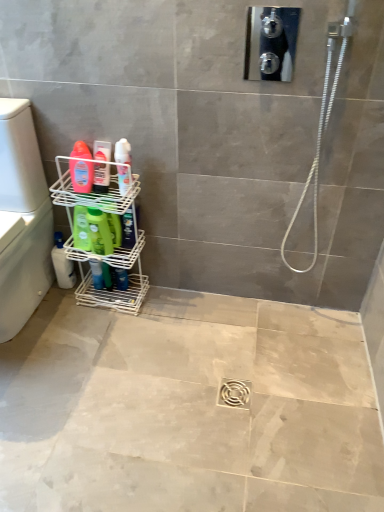
Question: Considering the positions of translucent plastic bottle at left, arranged as the second toiletry when viewed from the right, and green matte bottle at lower left, arranged as the second cleaning product when viewed from the front, in the image, is translucent plastic bottle at left, arranged as the second toiletry when viewed from the right, bigger or smaller than green matte bottle at lower left, arranged as the second cleaning product when viewed from the front,?

Choices:
 (A) small
 (B) big

Answer: (A)

Question: Based on their positions, is translucent plastic bottle at left, the first toiletry from the left, located to the left or right of green matte bottle at lower left, the 2th cleaning product in the bottom-to-top sequence?

Choices:
 (A) right
 (B) left

Answer: (A)

Question: Estimate the real-world distances between objects in this image. Which object is farther from the green matte bottle at left, which is the 3th cleaning product from right to left?

Choices:
 (A) green matte bottle at lower left, arranged as the second cleaning product when viewed from the front
 (B) matte pink bottle at left, which appears as the 3th cleaning product when ordered from the bottom
 (C) silver metallic hose at upper right
 (D) white glossy spray can at upper center, which appears as the 2th toiletry when viewed from the left
 (E) white plastic washer at left

Answer: (C)

Question: Which of these objects is positioned closest to the translucent plastic bottle at left, the first toiletry from the left?

Choices:
 (A) white plastic washer at left
 (B) white wire shelf at lower left
 (C) green matte bottle at left, the first cleaning product in the left-to-right sequence
 (D) matte pink bottle at left, which appears as the 3th cleaning product when ordered from the bottom
 (E) white glossy spray can at upper center, which appears as the 2th toiletry when viewed from the left

Answer: (D)